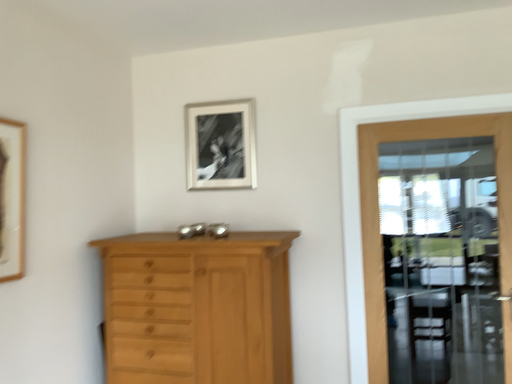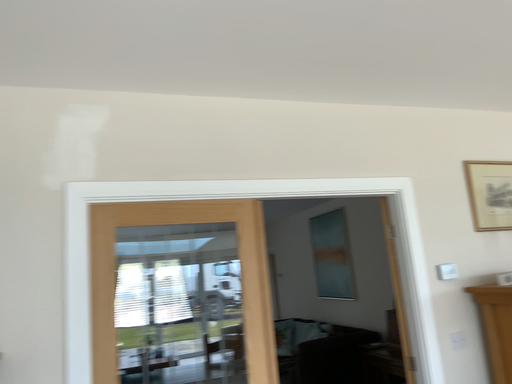
Question: How did the camera likely rotate when shooting the video?

Choices:
 (A) rotated upward
 (B) rotated downward

Answer: (A)